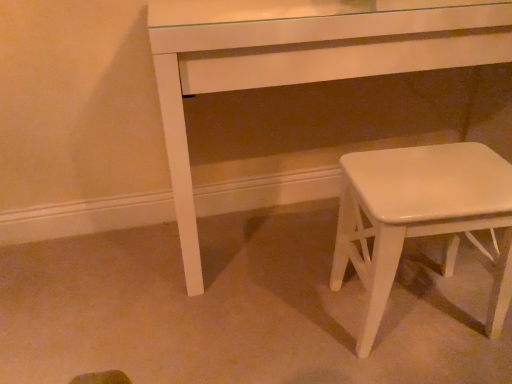
The image size is (512, 384). In order to click on vacant space situated above white glossy stool at lower right (from a real-world perspective) in this screenshot , I will do `click(436, 173)`.